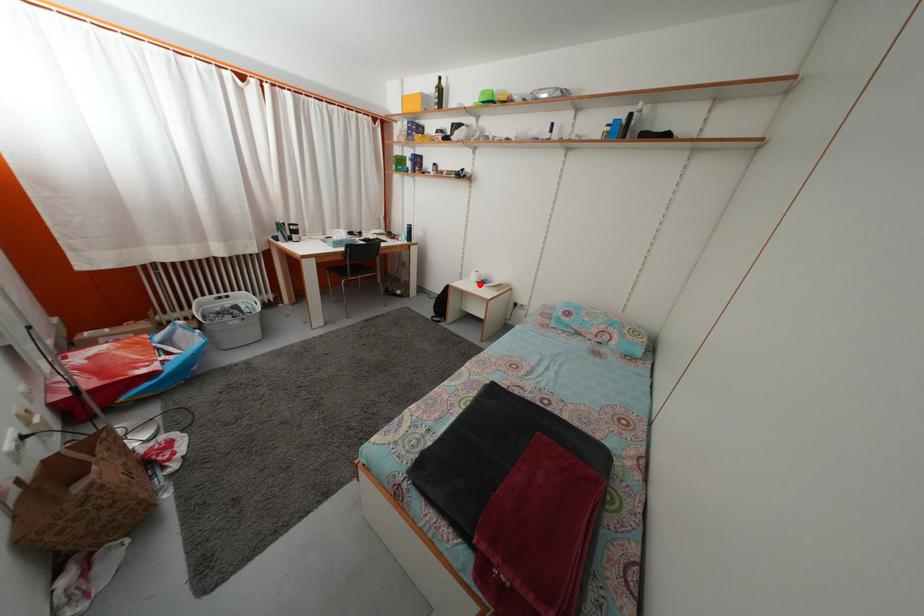
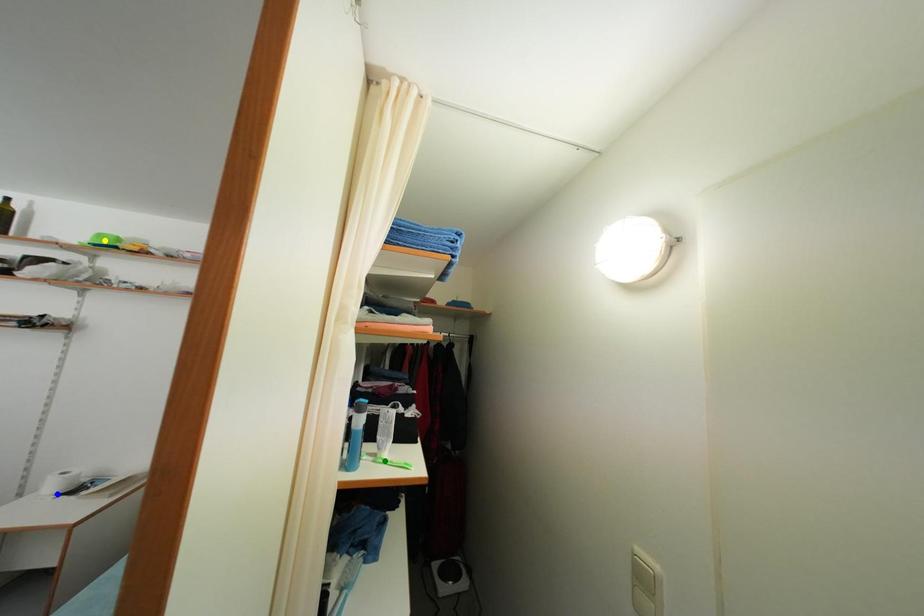
Question: I am providing you with two images of the same scene from different viewpoints. A red point is marked on the first image. You are given multiple points on the second image. Which point in image 2 is actually the same real-world point as the red point in image 1?

Choices:
 (A) green point
 (B) blue point
 (C) yellow point

Answer: (B)